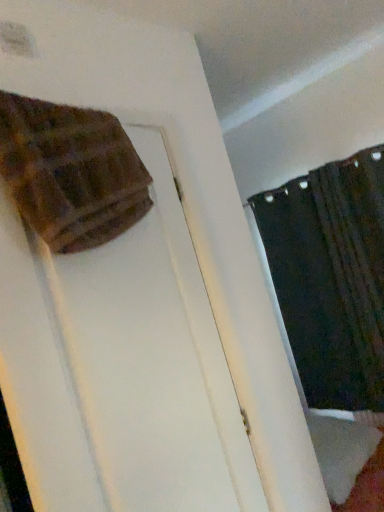
The height and width of the screenshot is (512, 384). Describe the element at coordinates (331, 277) in the screenshot. I see `black textured curtain at upper right` at that location.

Find the location of a particular element. The height and width of the screenshot is (512, 384). black textured curtain at upper right is located at coordinates (331, 277).

What do you see at coordinates (71, 172) in the screenshot? The height and width of the screenshot is (512, 384). I see `brown textured blanket at upper left` at bounding box center [71, 172].

Identify the location of brown textured blanket at upper left. (71, 172).

The image size is (384, 512). Identify the location of black textured curtain at upper right. (331, 277).

Which object is positioned more to the right, brown textured blanket at upper left or black textured curtain at upper right?

black textured curtain at upper right.

Considering their positions, is brown textured blanket at upper left located in front of or behind black textured curtain at upper right?

brown textured blanket at upper left is positioned closer to the viewer than black textured curtain at upper right.

Is point (121, 126) positioned before point (360, 232)?

Yes, it is in front of point (360, 232).

From the image's perspective, relative to black textured curtain at upper right, is brown textured blanket at upper left above or below?

brown textured blanket at upper left is above black textured curtain at upper right.

From a real-world perspective, does brown textured blanket at upper left sit lower than black textured curtain at upper right?

No, from a real-world perspective, brown textured blanket at upper left is not beneath black textured curtain at upper right.

Looking at this image, is brown textured blanket at upper left wider than black textured curtain at upper right?

Yes.

In the scene shown: Can you confirm if brown textured blanket at upper left is taller than black textured curtain at upper right?

Incorrect, the height of brown textured blanket at upper left is not larger of that of black textured curtain at upper right.

Between brown textured blanket at upper left and black textured curtain at upper right, which one has smaller size?

brown textured blanket at upper left.

Do you think brown textured blanket at upper left is within black textured curtain at upper right, or outside of it?

brown textured blanket at upper left is not inside black textured curtain at upper right, it's outside.

Is the surface of brown textured blanket at upper left in direct contact with black textured curtain at upper right?

No.

In the scene shown: Could you tell me if brown textured blanket at upper left is turned towards black textured curtain at upper right?

No, brown textured blanket at upper left is not aimed at black textured curtain at upper right.

How different are the orientations of brown textured blanket at upper left and black textured curtain at upper right in degrees?

There is a 99.9-degree angle between the facing directions of brown textured blanket at upper left and black textured curtain at upper right.

Identify the location of blanket above the black textured curtain at upper right (from a real-world perspective). (71, 172).

Is black textured curtain at upper right to the left of brown textured blanket at upper left from the viewer's perspective?

Incorrect, black textured curtain at upper right is not on the left side of brown textured blanket at upper left.

In the image, is black textured curtain at upper right positioned in front of or behind brown textured blanket at upper left?

Visually, black textured curtain at upper right is located behind brown textured blanket at upper left.

Is point (357, 258) farther from viewer compared to point (73, 234)?

Yes.

From the image's perspective, is black textured curtain at upper right located beneath brown textured blanket at upper left?

Correct, black textured curtain at upper right appears lower than brown textured blanket at upper left in the image.

From a real-world perspective, does black textured curtain at upper right stand above brown textured blanket at upper left?

No.

Considering the relative sizes of black textured curtain at upper right and brown textured blanket at upper left in the image provided, is black textured curtain at upper right thinner than brown textured blanket at upper left?

Yes.

Considering the sizes of objects black textured curtain at upper right and brown textured blanket at upper left in the image provided, who is taller, black textured curtain at upper right or brown textured blanket at upper left?

black textured curtain at upper right.

From the picture: Considering the sizes of objects black textured curtain at upper right and brown textured blanket at upper left in the image provided, who is bigger, black textured curtain at upper right or brown textured blanket at upper left?

With larger size is black textured curtain at upper right.

Is black textured curtain at upper right not within brown textured blanket at upper left?

black textured curtain at upper right is positioned outside brown textured blanket at upper left.

Is black textured curtain at upper right not close to brown textured blanket at upper left?

Yes.

Is black textured curtain at upper right oriented away from brown textured blanket at upper left?

No, black textured curtain at upper right is not facing the opposite direction of brown textured blanket at upper left.

What's the angular difference between black textured curtain at upper right and brown textured blanket at upper left's facing directions?

The angular difference between black textured curtain at upper right and brown textured blanket at upper left is 99.9 degrees.

Locate an element on the screen. blanket that appears in front of the black textured curtain at upper right is located at coordinates (71, 172).

This screenshot has height=512, width=384. In order to click on curtain below the brown textured blanket at upper left (from the image's perspective) in this screenshot , I will do pyautogui.click(x=331, y=277).

This screenshot has width=384, height=512. Find the location of `blanket above the black textured curtain at upper right (from the image's perspective)`. blanket above the black textured curtain at upper right (from the image's perspective) is located at coordinates (71, 172).